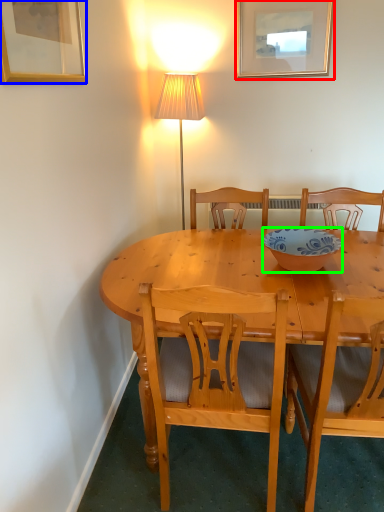
Question: Which is farther away from picture frame (highlighted by a red box)? picture frame (highlighted by a blue box) or bowl (highlighted by a green box)?

Choices:
 (A) picture frame
 (B) bowl

Answer: (A)